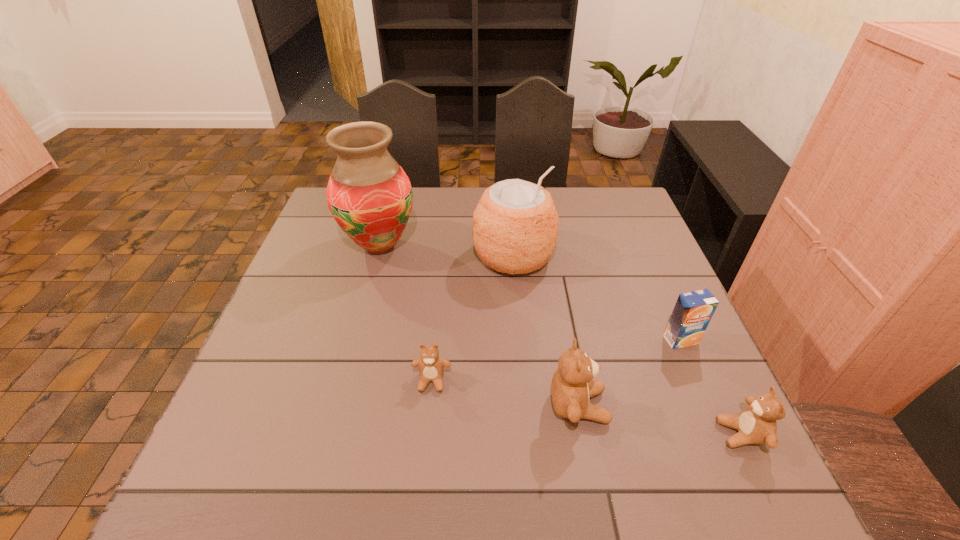
Locate an element on the screen. vacant area that lies between the fourth nearest object and the second tallest object is located at coordinates (597, 298).

Find the location of a particular element. Image resolution: width=960 pixels, height=540 pixels. unoccupied position between the third tallest object and the leftmost teddy bear is located at coordinates (505, 393).

Find the location of a particular element. The image size is (960, 540). free space between the fifth object from right to left and the tallest object is located at coordinates (406, 313).

Identify the location of free space between the vase and the leftmost teddy bear. The height and width of the screenshot is (540, 960). (406, 313).

Where is `free spot between the coconut and the orange_juice`? The image size is (960, 540). free spot between the coconut and the orange_juice is located at coordinates (597, 298).

Identify the location of vacant space in between the second tallest object and the fourth nearest object. tap(597, 298).

Where is `free space between the leftmost object and the fourth shortest object`? free space between the leftmost object and the fourth shortest object is located at coordinates (479, 326).

Identify the location of blank region between the leftmost object and the shortest teddy bear. Image resolution: width=960 pixels, height=540 pixels. (406, 313).

Locate an element on the screen. This screenshot has height=540, width=960. object that ranks as the closest to the second tallest object is located at coordinates (369, 195).

Locate which object is the third closest to the shortest teddy bear. Please provide its 2D coordinates. Your answer should be formatted as a tuple, i.e. [(x, y)], where the tuple contains the x and y coordinates of a point satisfying the conditions above.

[(369, 195)]